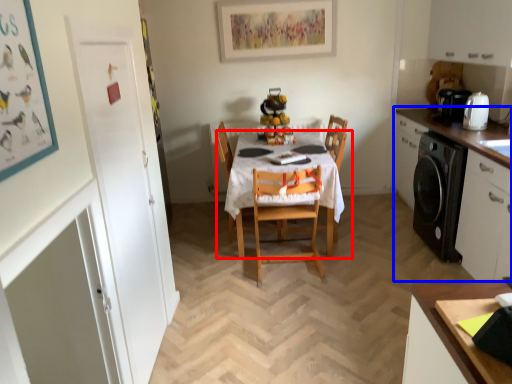
Question: Among these objects, which one is nearest to the camera, kitchen & dining room table (highlighted by a red box) or cabinetry (highlighted by a blue box)?

Choices:
 (A) kitchen & dining room table
 (B) cabinetry

Answer: (B)